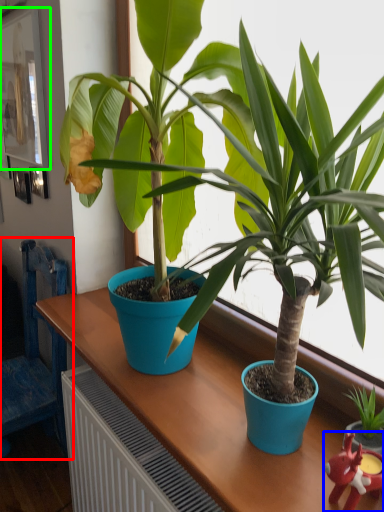
Question: Which object is positioned farthest from chair (highlighted by a red box)? Select from toy (highlighted by a blue box) and picture frame (highlighted by a green box).

Choices:
 (A) toy
 (B) picture frame

Answer: (A)